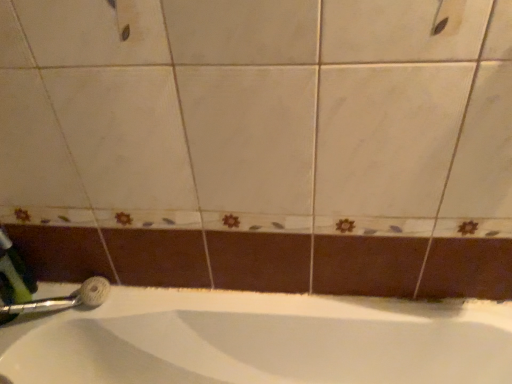
What do you see at coordinates (260, 341) in the screenshot?
I see `white glossy bathtub at lower left` at bounding box center [260, 341].

What are the coordinates of `white glossy bathtub at lower left` in the screenshot? It's located at (260, 341).

What is the approximate width of white glossy bathtub at lower left?

11.24 inches.

Identify the location of white glossy bathtub at lower left. (260, 341).